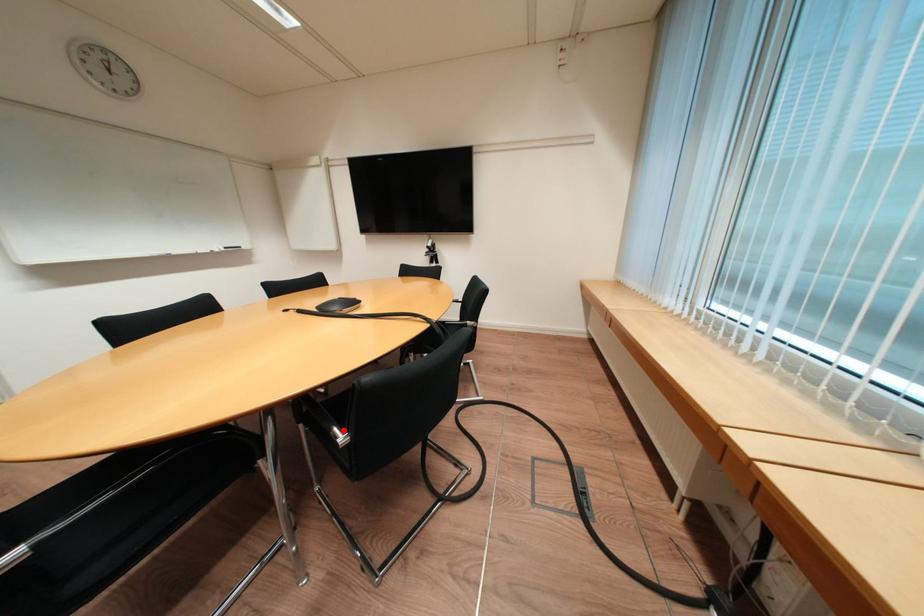
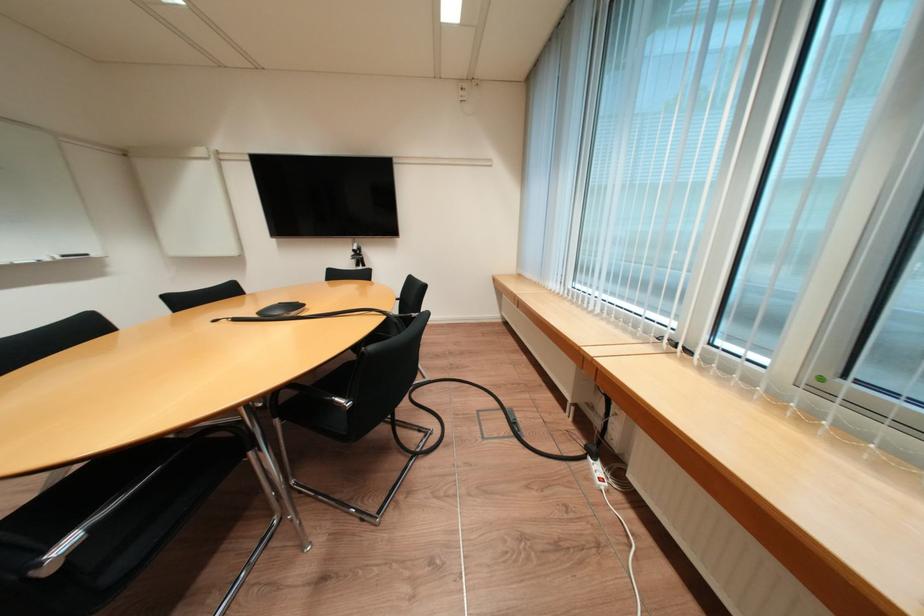
Where in the second image is the point corresponding to the highlighted location from the first image?

(345, 400)